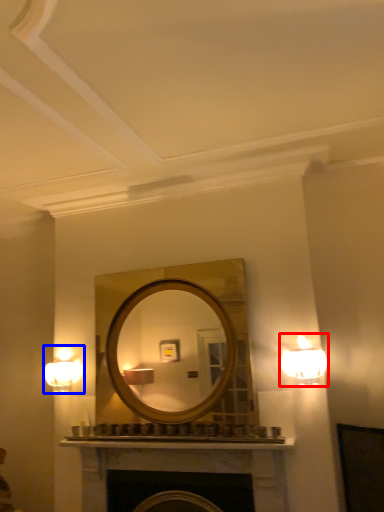
Question: Which object is closer to the camera taking this photo, lamp (highlighted by a red box) or fixture (highlighted by a blue box)?

Choices:
 (A) lamp
 (B) fixture

Answer: (A)